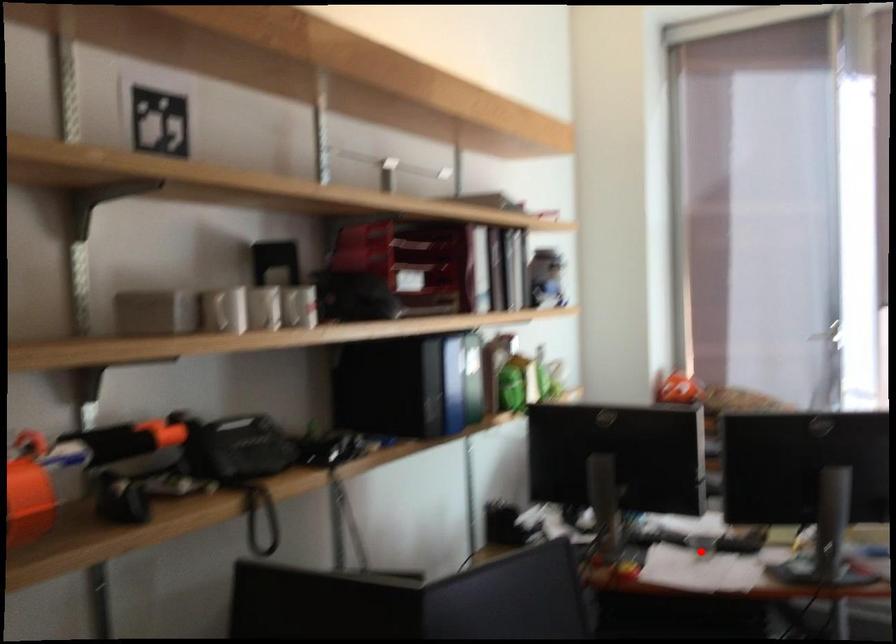
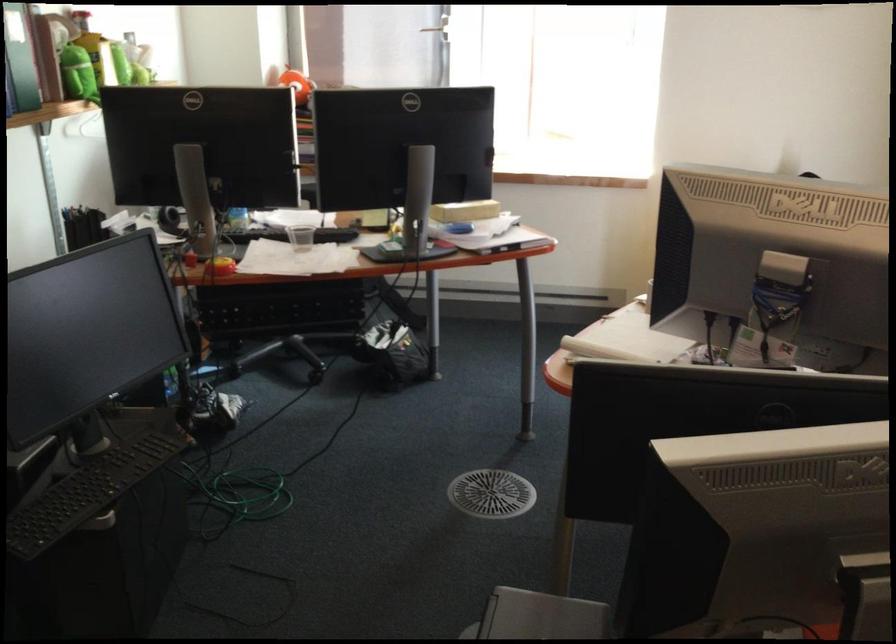
Locate, in the second image, the point that corresponds to the highlighted location in the first image.

(300, 238)